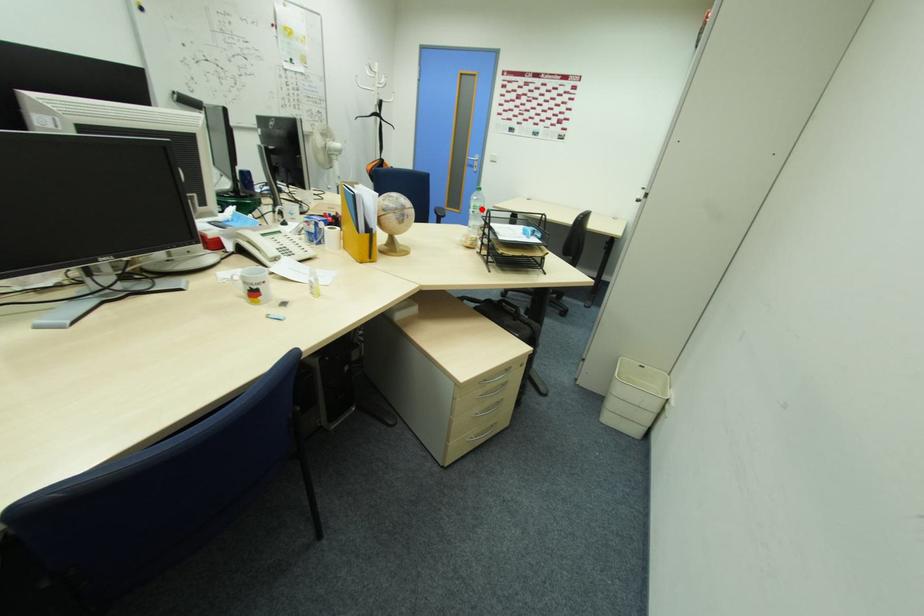
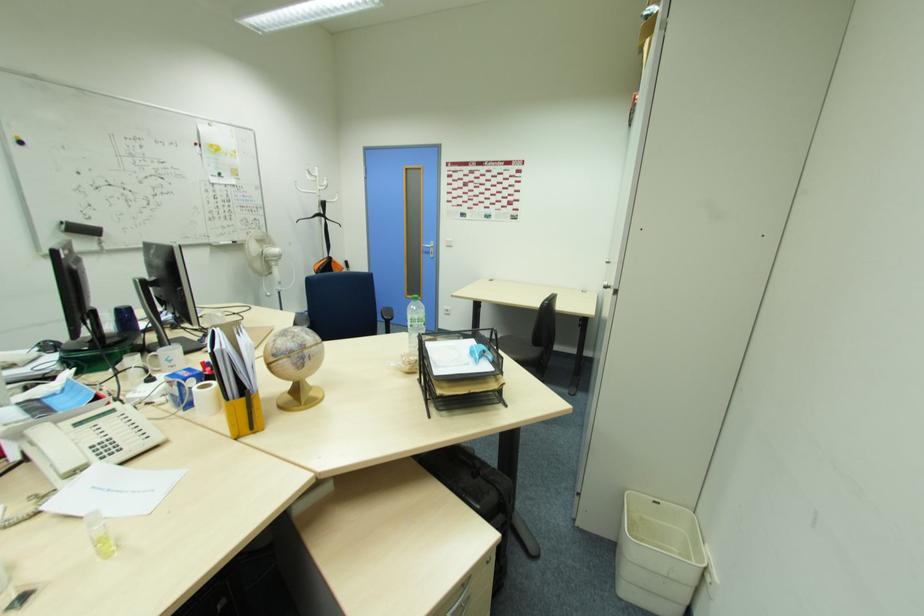
In the second image, find the point that corresponds to the highlighted location in the first image.

(419, 322)